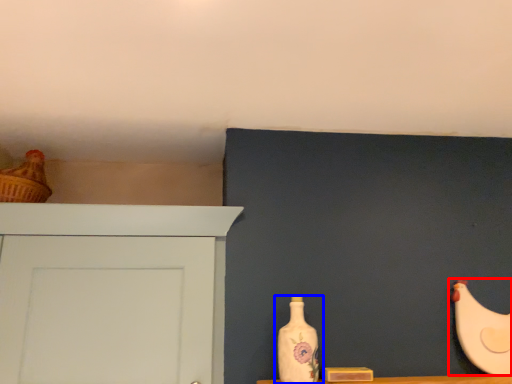
Question: Among these objects, which one is farthest to the camera, chicken (highlighted by a red box) or bottle (highlighted by a blue box)?

Choices:
 (A) chicken
 (B) bottle

Answer: (A)